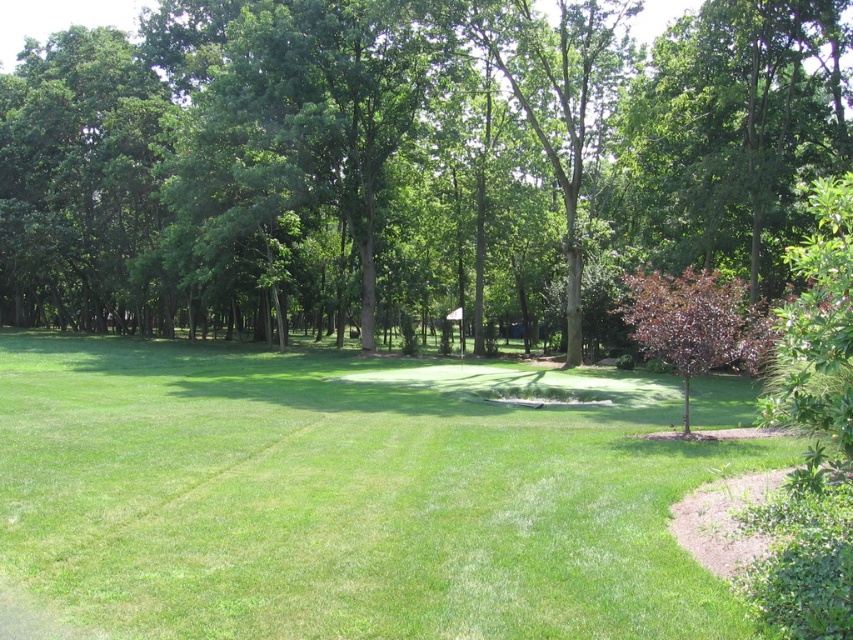
You are standing at the center of the grassy area and see the point marked at coordinates (407, 161). What object is located at that point?

The point at coordinates (407, 161) indicates a green leafy tree at center.

You are planning to place a picnic blanket on the green grass at center. The picnic blanket is 2 meters wide. Can the green leafy tree at center provide enough shade to cover the entire blanket?

The green leafy tree at center might be wider than green grass at center, so it is possible that the tree provides enough shade to cover the entire 2 meter wide picnic blanket.